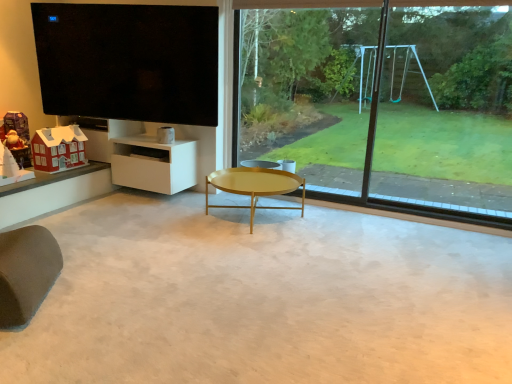
Locate an element on the screen. The image size is (512, 384). vacant space to the right of brown fabric swivel chair at lower left is located at coordinates (99, 304).